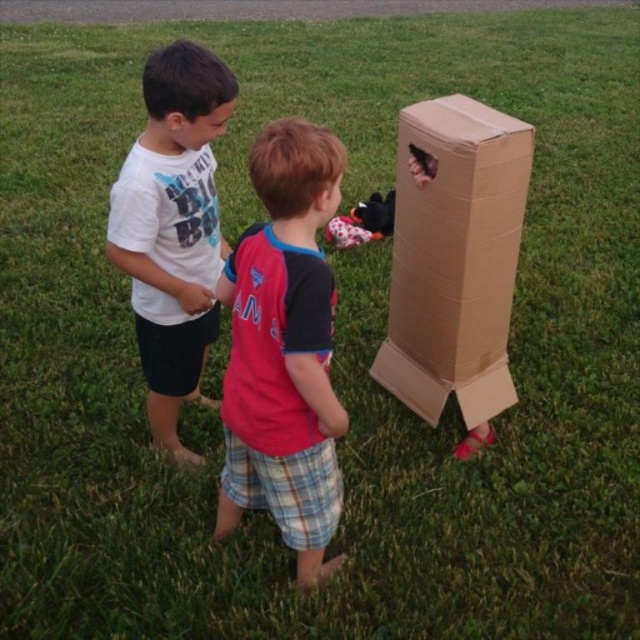
Question: Which point is closer to the camera taking this photo?

Choices:
 (A) (387, 209)
 (B) (280, 344)
 (C) (189, 284)

Answer: (B)

Question: Is pink fabric shirt at center positioned at the back of brown cardboard box at right?

Choices:
 (A) no
 (B) yes

Answer: (A)

Question: Does brown cardboard box at right appear on the right side of white cotton shirt at center?

Choices:
 (A) no
 (B) yes

Answer: (B)

Question: Among these objects, which one is farthest from the camera?

Choices:
 (A) pink fabric shirt at center
 (B) black plush toy at center
 (C) brown cardboard box at right

Answer: (B)

Question: Does brown cardboard box at right appear over white cotton shirt at center?

Choices:
 (A) yes
 (B) no

Answer: (A)

Question: Which object is positioned farthest from the black plush toy at center?

Choices:
 (A) white cotton shirt at center
 (B) brown cardboard box at right

Answer: (A)